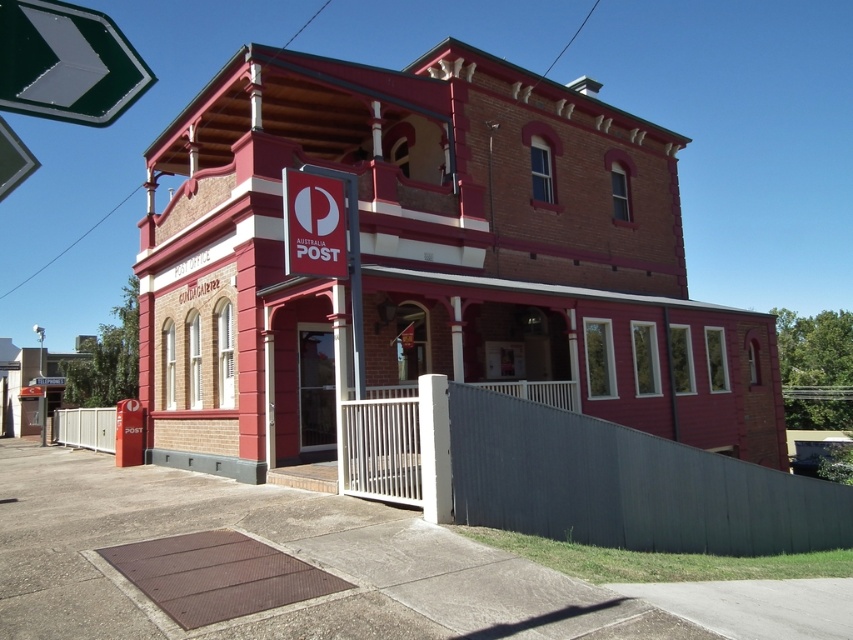
You are a delivery driver who needs to locate the Australia Post entrance. You see the green reflective arrow at upper left and the matte red sign at center. Which object is narrower?

The green reflective arrow at upper left is thinner than the matte red sign at center, so the green reflective arrow at upper left is narrower.

You are a delivery person approaching the Australia Post building. You need to locate the entrance. Based on the scene, which object is closer to you, the matte red sign at center or the white metal fence at lower left?

The matte red sign at center is closer to you because it is in front of the white metal fence at lower left.

You are a delivery person approaching the Australia Post building. You see the matte red sign at center and the white metal fence at lower left. Which object is located to the right of the other?

The matte red sign at center is positioned on the right side of white metal fence at lower left.